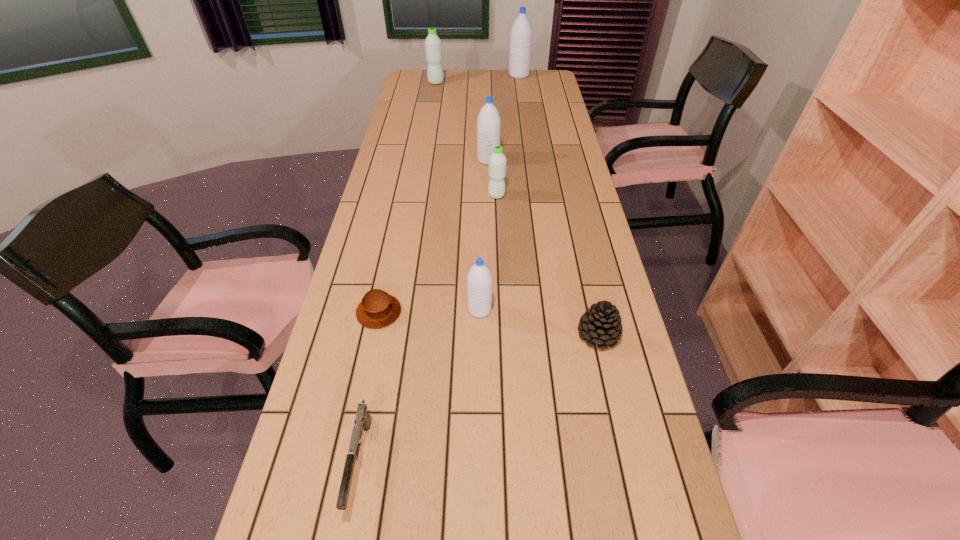
Where is `blank area in the image that satisfies the following two spatial constraints: 1. on the back side of the rightmost blue water bottle; 2. on the left side of the shortest object`? The height and width of the screenshot is (540, 960). blank area in the image that satisfies the following two spatial constraints: 1. on the back side of the rightmost blue water bottle; 2. on the left side of the shortest object is located at coordinates (427, 75).

At what (x,y) coordinates should I click in order to perform the action: click on vacant point that satisfies the following two spatial constraints: 1. on the front side of the smaller green water bottle; 2. on the left side of the second smallest blue water bottle. Please return your answer as a coordinate pair (x, y). The width and height of the screenshot is (960, 540). Looking at the image, I should click on (490, 195).